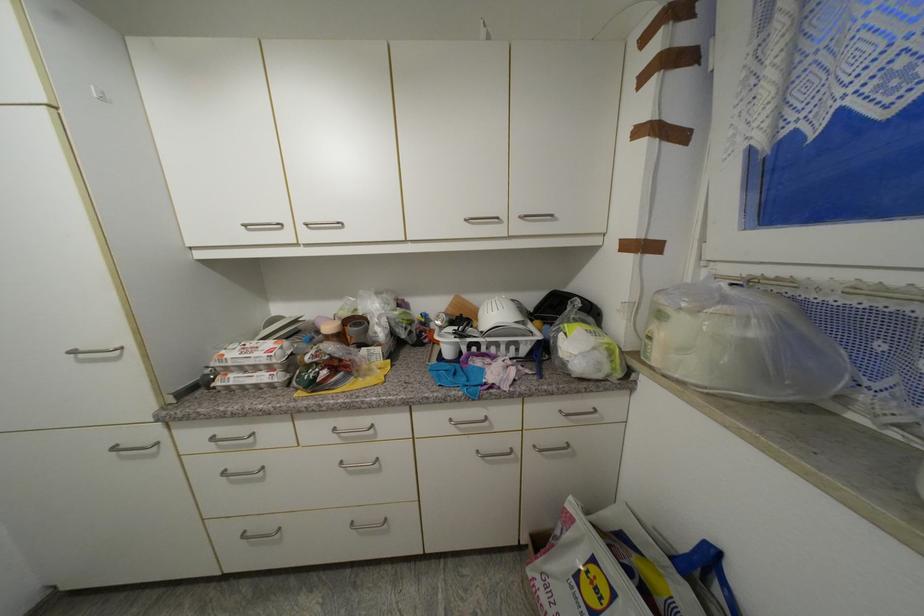
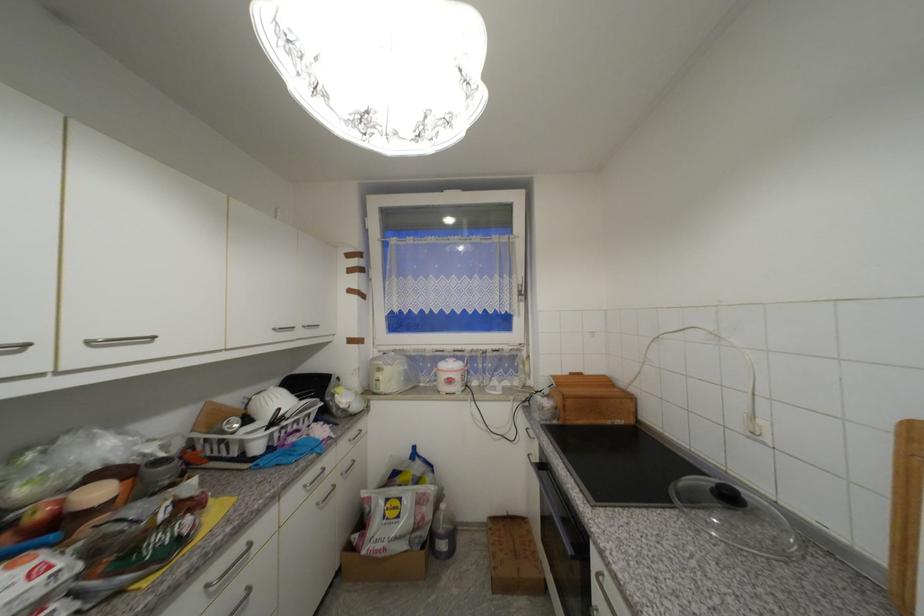
Where in the second image is the point corresponding to pixel 483 454 from the first image?

(322, 505)